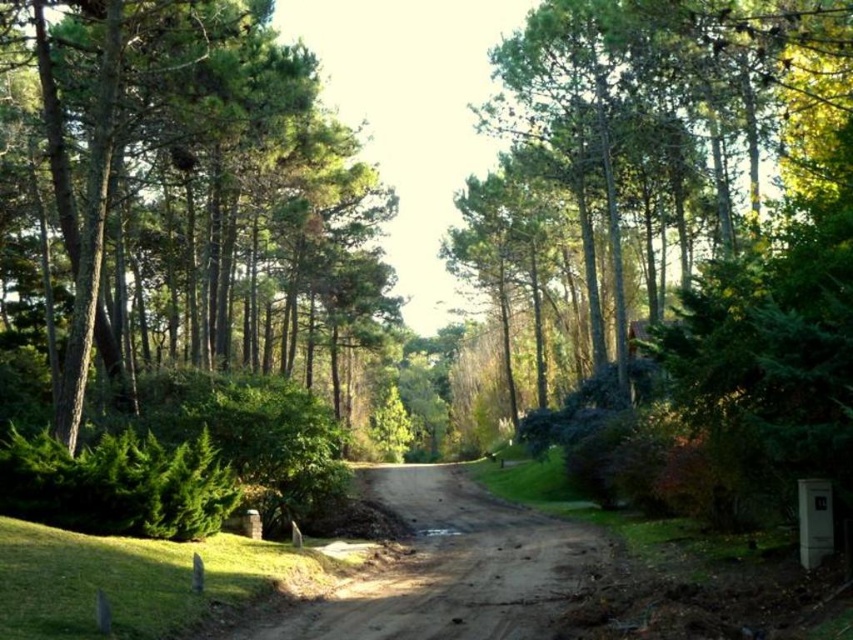
You are standing at the point with coordinates (651,122) in the forest scene. What object is located exactly at that point?

The green leafy tree at center is located exactly at point (651,122).

You are a hiker standing at the edge of the forest. You see a green leafy tree at center and a brown dirt track at center. Which object is taller?

The green leafy tree at center is much taller than the brown dirt track at center.

You are a hiker carrying a 10 meter long tent pole. You need to set up camp between the green leafy tree at left and the green leafy tree at center. Can you fit the tent pole horizontally between them without bending it?

The distance between the green leafy tree at left and green leafy tree at center is 14.12 meters, which is longer than the 10 meter tent pole. Therefore, the tent pole can be placed horizontally between them without bending.